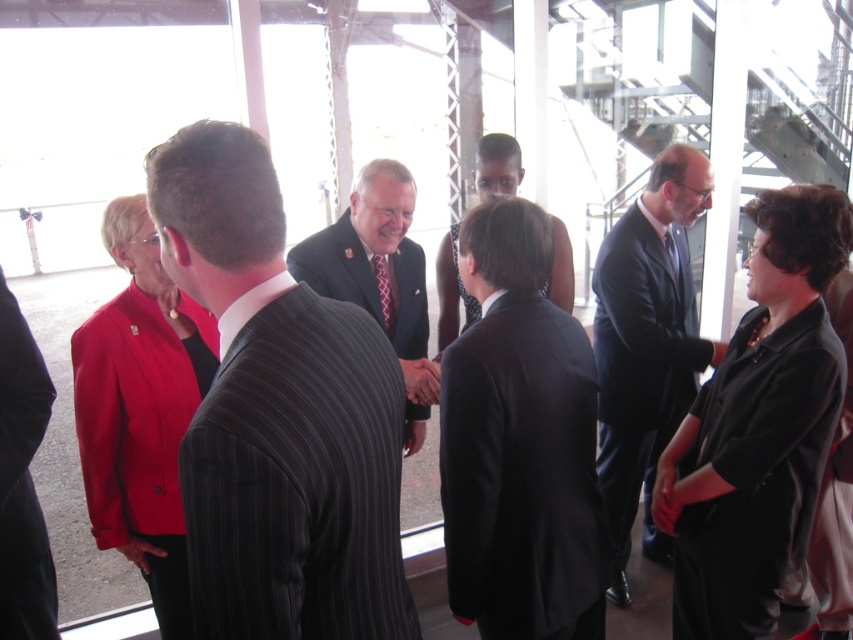
Does matte red blazer at left appear over matte black suit at center?

Actually, matte red blazer at left is below matte black suit at center.

Does point (164, 376) lie in front of point (494, 172)?

Yes.

Does point (117, 228) lie behind point (465, 314)?

No, it is in front of (465, 314).

Where is `matte red blazer at left`? Image resolution: width=853 pixels, height=640 pixels. matte red blazer at left is located at coordinates (141, 410).

Is black satin blouse at center behind black pinstripe suit at left?

No.

At what (x,y) coordinates should I click in order to perform the action: click on black satin blouse at center. Please return your answer as a coordinate pair (x, y). Looking at the image, I should click on (759, 426).

Who is shorter, dark pinstripe suit at center or black satin blouse at center?

dark pinstripe suit at center is shorter.

Does dark pinstripe suit at center lie behind black satin blouse at center?

No, dark pinstripe suit at center is in front of black satin blouse at center.

Is point (247, 282) behind point (733, 624)?

No, (247, 282) is in front of (733, 624).

This screenshot has width=853, height=640. What are the coordinates of `dark pinstripe suit at center` in the screenshot? It's located at (277, 416).